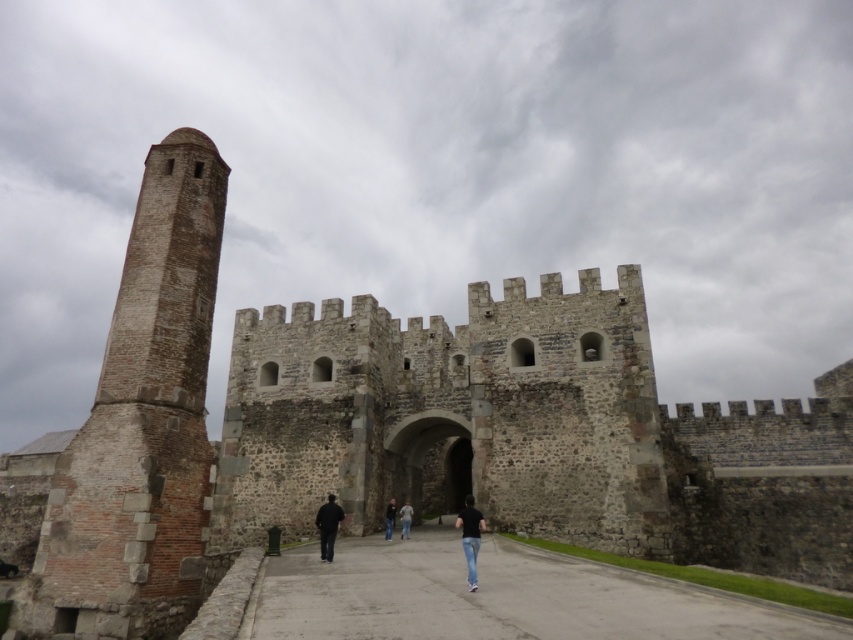
Question: Observing the image, what is the correct spatial positioning of brown stone tower at left in reference to black matte shirt at center?

Choices:
 (A) right
 (B) left

Answer: (B)

Question: Which of the following is the farthest from the observer?

Choices:
 (A) gray concrete path at center
 (B) brown stone tower at left
 (C) black matte shirt at center

Answer: (B)

Question: Which object is closer to the camera taking this photo?

Choices:
 (A) black matte shirt at center
 (B) dark gray jeans at center
 (C) brown stone tower at left
 (D) gray concrete path at center

Answer: (D)

Question: Among these objects, which one is nearest to the camera?

Choices:
 (A) dark gray fabric jacket at center
 (B) black matte shirt at center
 (C) brown stone tower at left
 (D) dark gray jeans at center

Answer: (B)

Question: Does dark gray jeans at center lie in front of dark blue jeans at center?

Choices:
 (A) no
 (B) yes

Answer: (A)

Question: Can you confirm if black matte shirt at center is positioned below dark blue jeans at center?

Choices:
 (A) no
 (B) yes

Answer: (A)